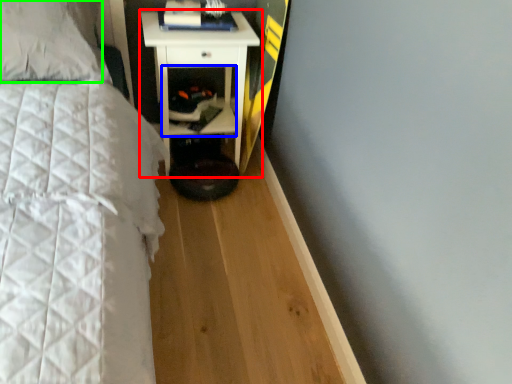
Question: Estimate the real-world distances between objects in this image. Which object is closer to nightstand (highlighted by a red box), cabinet (highlighted by a blue box) or pillow (highlighted by a green box)?

Choices:
 (A) cabinet
 (B) pillow

Answer: (A)